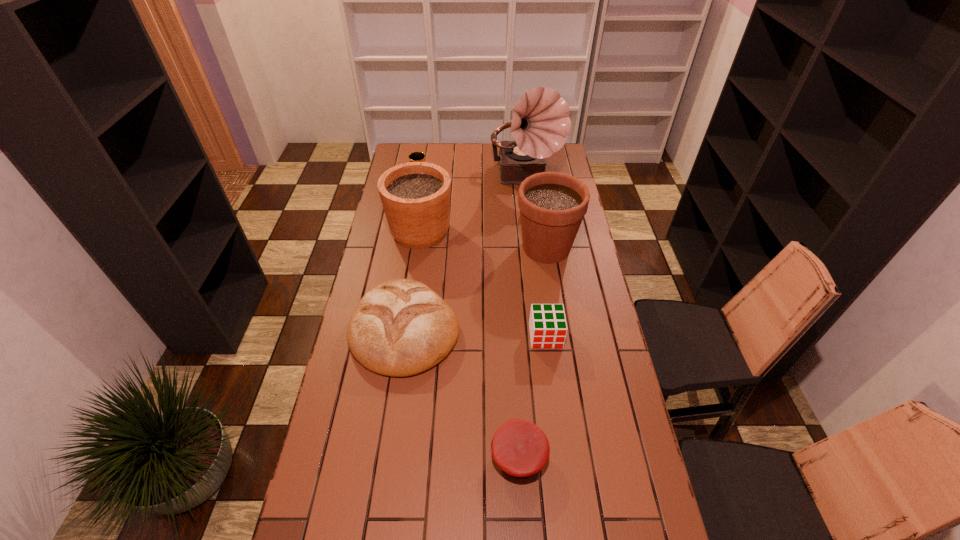
This screenshot has height=540, width=960. I want to click on free spot between the left flowerpot and the nearest object, so click(469, 344).

Identify the location of object that stands as the fourth closest to the left flowerpot. (552, 205).

Identify which object is the fifth nearest to the cube. Please provide its 2D coordinates. Your answer should be formatted as a tuple, i.e. [(x, y)], where the tuple contains the x and y coordinates of a point satisfying the conditions above.

[(540, 123)]

The height and width of the screenshot is (540, 960). I want to click on vacant region that satisfies the following two spatial constraints: 1. from the horn of the tallest object; 2. at the front of the cap where the visor is located, so click(561, 456).

The image size is (960, 540). I want to click on blank space that satisfies the following two spatial constraints: 1. from the horn of the tallest object; 2. at the front of the nearest object where the visor is located, so click(x=561, y=456).

The width and height of the screenshot is (960, 540). Identify the location of free location that satisfies the following two spatial constraints: 1. on the red face of the cube; 2. at the front of the nearest object where the visor is located. (561, 456).

Identify the location of free location that satisfies the following two spatial constraints: 1. on the red face of the cube; 2. at the front of the cap where the visor is located. (561, 456).